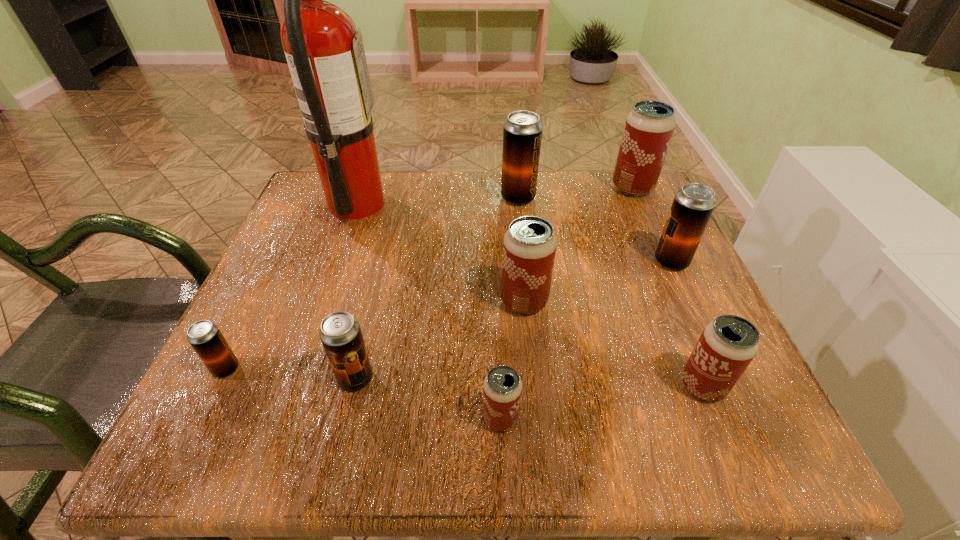
You are a GUI agent. You are given a task and a screenshot of the screen. Output one action in this format:
    pyautogui.click(x=<x>, y=<y>)
    Task: Click on the vacant point that satisfies the following two spatial constraints: 1. on the nozzle side of the tallest object; 2. on the left side of the sixth nearest beer can
    
    Given the screenshot: What is the action you would take?
    pyautogui.click(x=336, y=261)

This screenshot has height=540, width=960. What are the coordinates of `free region that satisfies the following two spatial constraints: 1. on the back side of the second smallest red beer can; 2. on the nozzle side of the fire extinguisher` in the screenshot? It's located at (627, 204).